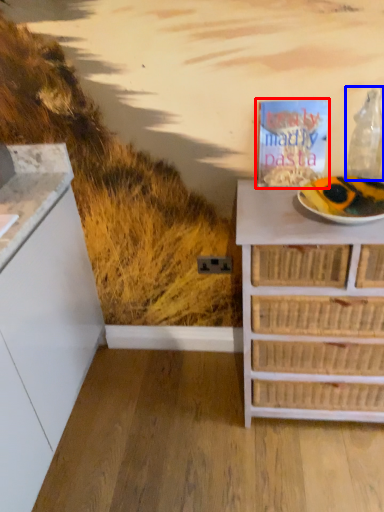
Question: Among these objects, which one is farthest to the camera, magazine (highlighted by a red box) or wine bottle (highlighted by a blue box)?

Choices:
 (A) magazine
 (B) wine bottle

Answer: (A)